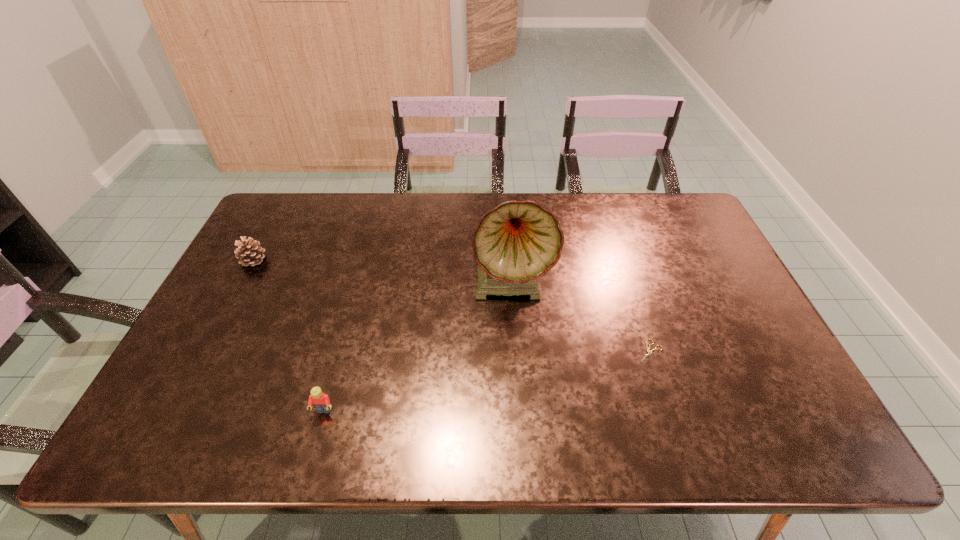
Identify which object is located as the nearest to the Lego. Please provide its 2D coordinates. Your answer should be formatted as a tuple, i.e. [(x, y)], where the tuple contains the x and y coordinates of a point satisfying the conditions above.

[(516, 243)]

Where is `blank space that satisfies the following two spatial constraints: 1. from the horn of the tallest object; 2. on the left side of the third farthest object`? This screenshot has height=540, width=960. blank space that satisfies the following two spatial constraints: 1. from the horn of the tallest object; 2. on the left side of the third farthest object is located at coordinates (516, 352).

The image size is (960, 540). Find the location of `vacant area in the image that satisfies the following two spatial constraints: 1. on the front side of the leftmost object; 2. on the left side of the shears`. vacant area in the image that satisfies the following two spatial constraints: 1. on the front side of the leftmost object; 2. on the left side of the shears is located at coordinates (205, 352).

Locate an element on the screen. The image size is (960, 540). free space that satisfies the following two spatial constraints: 1. from the horn of the third farthest object; 2. on the left side of the third object from left to right is located at coordinates (516, 352).